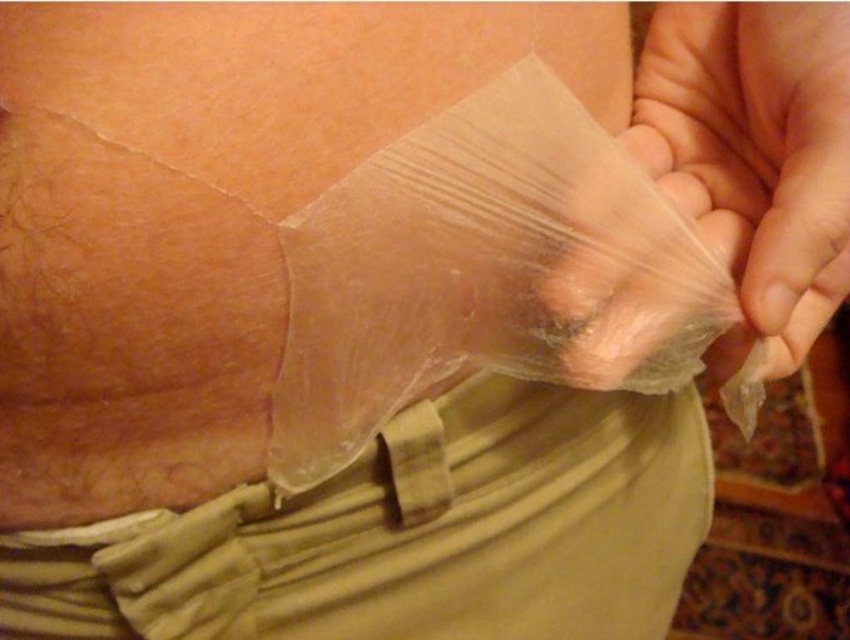
Which of these two, transparent plastic at lower center or transparent plastic bag at lower right, stands taller?

With more height is transparent plastic bag at lower right.

Between point (499, 156) and point (687, 10), which one is positioned in front?

Point (499, 156) is in front.

Locate an element on the screen. The width and height of the screenshot is (850, 640). transparent plastic at lower center is located at coordinates (484, 272).